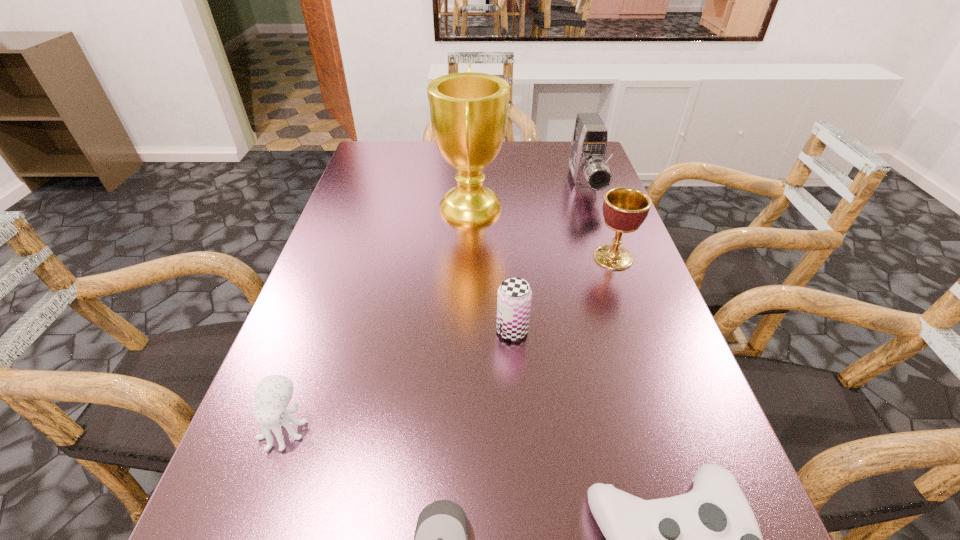
In the image, there is a desktop. What are the coordinates of `vacant region at the right edge` in the screenshot? It's located at (664, 438).

In order to click on vacant space at the far left corner of the desktop in this screenshot , I will do `click(388, 166)`.

In the image, there is a desktop. At what (x,y) coordinates should I click in order to perform the action: click on vacant area at the far right corner. Please return your answer as a coordinate pair (x, y). This screenshot has width=960, height=540. Looking at the image, I should click on (542, 147).

The width and height of the screenshot is (960, 540). What are the coordinates of `unoccupied position between the fifth tallest object and the chalice` in the screenshot? It's located at (448, 342).

Image resolution: width=960 pixels, height=540 pixels. Find the location of `free space between the octopus and the beer can`. free space between the octopus and the beer can is located at coordinates (398, 379).

Locate an element on the screen. This screenshot has height=540, width=960. empty location between the chalice and the camcorder is located at coordinates (599, 221).

Find the location of a particular element. free space between the fourth shortest object and the chalice is located at coordinates (563, 294).

Identify the location of free space between the chalice and the camcorder. (599, 221).

You are a GUI agent. You are given a task and a screenshot of the screen. Output one action in this format:
    pyautogui.click(x=<x>, y=<y>)
    Task: Click on the empty space that is in between the octopus and the chalice
    Image resolution: width=960 pixels, height=540 pixels.
    Given the screenshot: What is the action you would take?
    pyautogui.click(x=448, y=342)

Where is `the fourth closest object to the fourth tallest object`? This screenshot has height=540, width=960. the fourth closest object to the fourth tallest object is located at coordinates (441, 536).